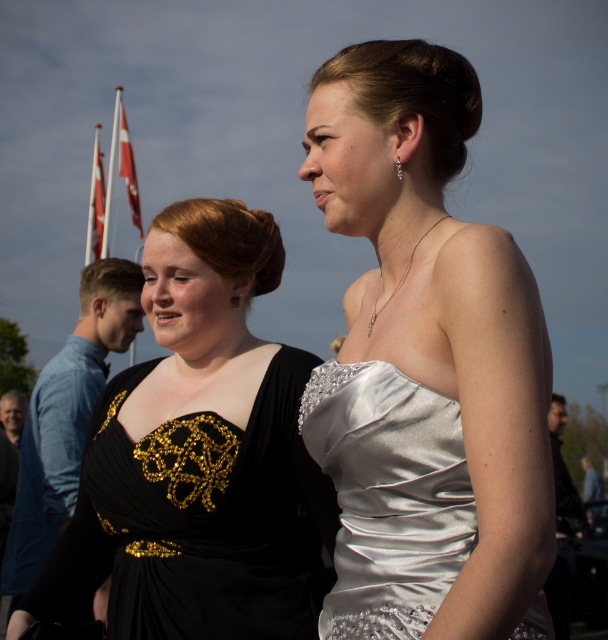
You are standing in front of the image and want to determine which of the two points, point (434, 508) or point (94, 195), is nearer to you. Based on the description, which point is closer?

Point (434, 508) is closer to the viewer than point (94, 195).

You are standing in front of the two women at the social event. You want to determine which of the two points, point (161, 225) or point (123, 132), is nearer to you. Which one is closer?

Point (161, 225) is closer to the viewer than point (123, 132).

In the scene shown: You are a photographer positioned at the location of the satin dress at center and want to capture a photo that includes the white fabric flag at upper left. Given that your camera has a maximum zoom range of 20 meters, can you clearly capture the flag in your photo?

The distance between the satin dress at center and the white fabric flag at upper left is 21.56 meters. Since the camera can only zoom up to 20 meters, it cannot clearly capture the flag at that distance.